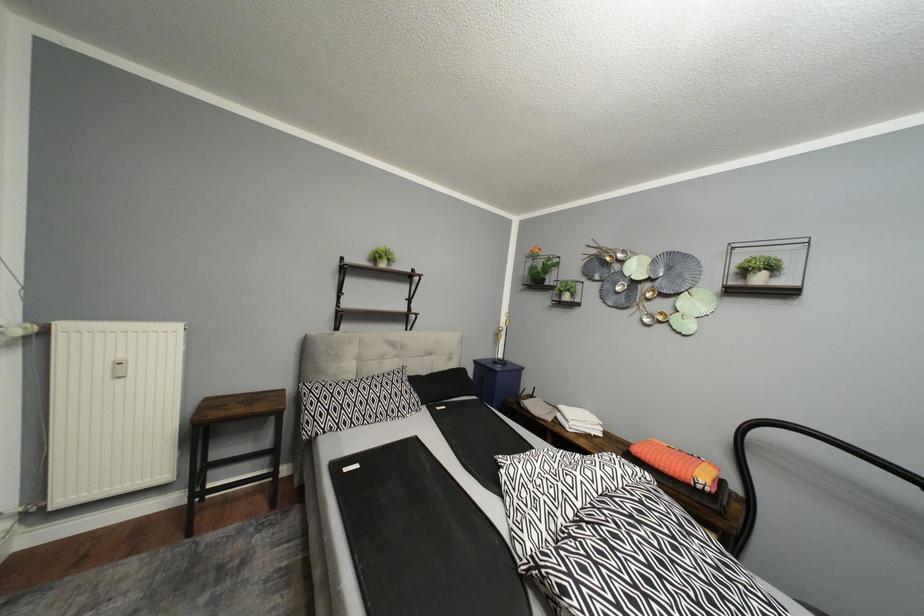
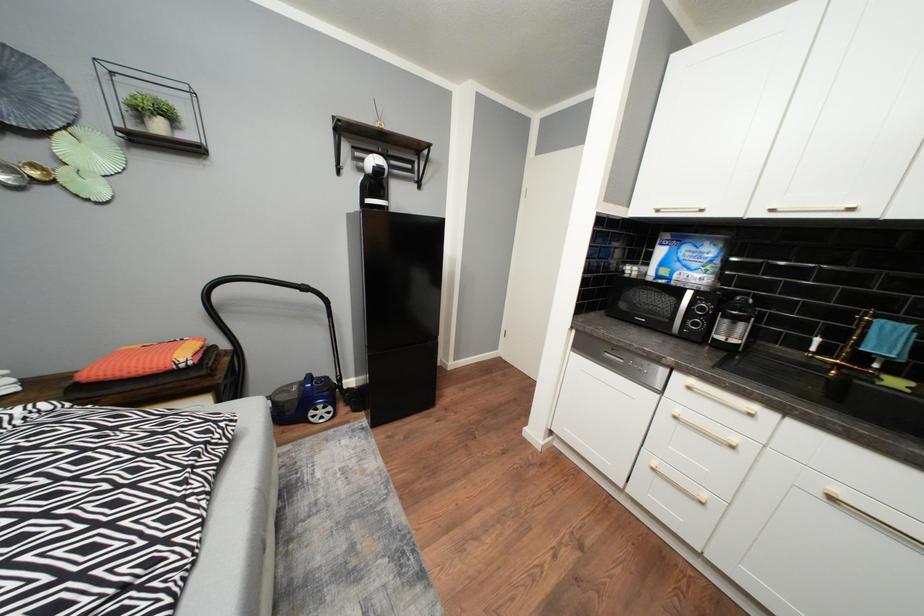
Based on the continuous images, in which direction is the camera rotating?

The rotation direction of the camera is right-down.